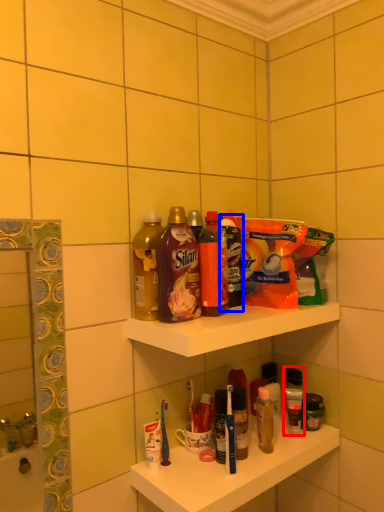
Question: Which object is further to the camera taking this photo, toiletry (highlighted by a red box) or cleaning product (highlighted by a blue box)?

Choices:
 (A) toiletry
 (B) cleaning product

Answer: (A)